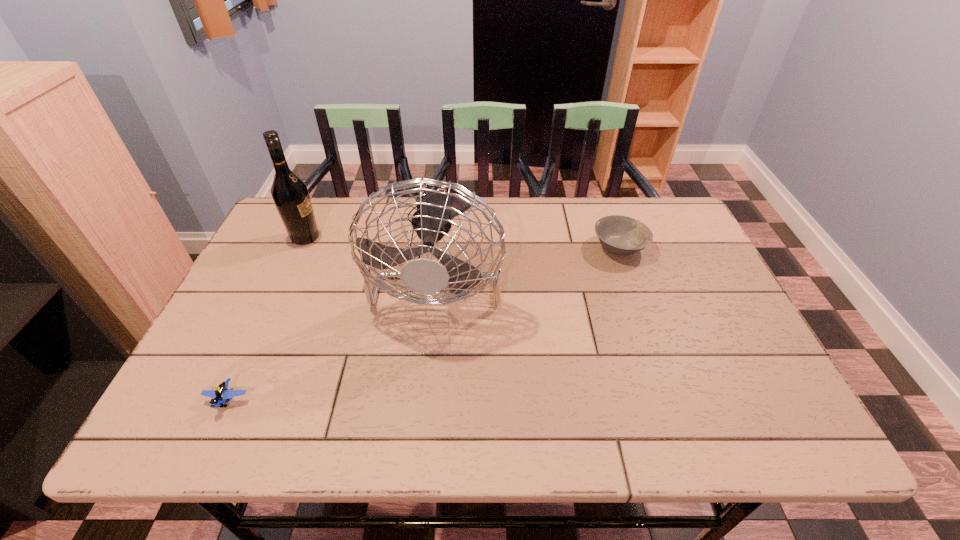
Locate an element on the screen. free space between the wine bottle and the rightmost object is located at coordinates (463, 242).

Locate an element on the screen. Image resolution: width=960 pixels, height=540 pixels. object that is the second nearest to the third object from left to right is located at coordinates (222, 392).

Where is `object that can be found as the second closest to the wine bottle`? The height and width of the screenshot is (540, 960). object that can be found as the second closest to the wine bottle is located at coordinates (222, 392).

At what (x,y) coordinates should I click in order to perform the action: click on free location that satisfies the following two spatial constraints: 1. on the label of the wine bottle; 2. on the back side of the bowl. Please return your answer as a coordinate pair (x, y). The image size is (960, 540). Looking at the image, I should click on (300, 247).

What are the coordinates of `free space that satisfies the following two spatial constraints: 1. on the label of the wine bottle; 2. on the front-facing side of the Lego` in the screenshot? It's located at (231, 400).

Locate an element on the screen. The width and height of the screenshot is (960, 540). vacant space that satisfies the following two spatial constraints: 1. on the label of the wine bottle; 2. on the front-facing side of the nearest object is located at coordinates (231, 400).

Where is `vacant space that satisfies the following two spatial constraints: 1. on the label of the wine bottle; 2. on the back side of the rightmost object`? This screenshot has height=540, width=960. vacant space that satisfies the following two spatial constraints: 1. on the label of the wine bottle; 2. on the back side of the rightmost object is located at coordinates (300, 247).

In order to click on vacant area that satisfies the following two spatial constraints: 1. on the label of the wine bottle; 2. on the left side of the bowl in this screenshot , I will do `click(300, 247)`.